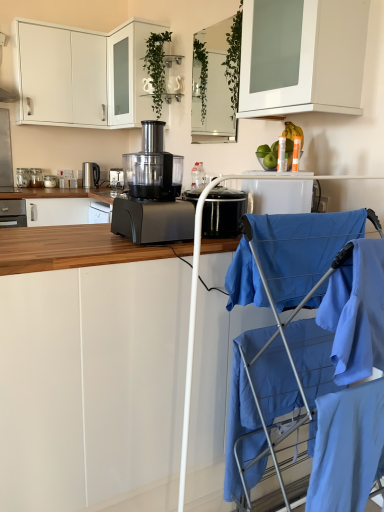
Question: Can you confirm if black plastic food processor at center, the first kitchen appliance from the front, is taller than white glossy cabinet at upper center, the 4th cabinetry positioned from the bottom?

Choices:
 (A) yes
 (B) no

Answer: (B)

Question: Does black plastic food processor at center, placed as the 2th kitchen appliance when sorted from right to left, have a lesser height compared to white glossy cabinet at upper center, marked as the second cabinetry in a top-to-bottom arrangement?

Choices:
 (A) no
 (B) yes

Answer: (B)

Question: Is black plastic food processor at center, placed as the 2th kitchen appliance when sorted from right to left, completely or partially outside of white glossy cabinet at upper center, the 4th cabinetry positioned from the bottom?

Choices:
 (A) yes
 (B) no

Answer: (A)

Question: From the image's perspective, is black plastic food processor at center, positioned as the 5th kitchen appliance in back-to-front order, below white glossy cabinet at upper center, marked as the second cabinetry in a top-to-bottom arrangement?

Choices:
 (A) no
 (B) yes

Answer: (B)

Question: Does black plastic food processor at center, positioned as the 5th kitchen appliance in back-to-front order, have a lesser width compared to white glossy cabinet at upper center, the 4th cabinetry positioned from the bottom?

Choices:
 (A) no
 (B) yes

Answer: (A)

Question: Does point (137, 178) appear closer or farther from the camera than point (220, 88)?

Choices:
 (A) farther
 (B) closer

Answer: (B)

Question: From a real-world perspective, is black plastic food processor at center, the fourth kitchen appliance viewed from the left, positioned above or below clear glass mirror at upper center, the third cabinetry from the bottom?

Choices:
 (A) below
 (B) above

Answer: (A)

Question: Considering the positions of black plastic food processor at center, placed as the 2th kitchen appliance when sorted from right to left, and clear glass mirror at upper center, the third cabinetry from the bottom, in the image, is black plastic food processor at center, placed as the 2th kitchen appliance when sorted from right to left, taller or shorter than clear glass mirror at upper center, the third cabinetry from the bottom,?

Choices:
 (A) tall
 (B) short

Answer: (B)

Question: Visually, is black plastic food processor at center, the fourth kitchen appliance viewed from the left, positioned to the left or to the right of clear glass mirror at upper center, which ranks as the third cabinetry in top-to-bottom order?

Choices:
 (A) left
 (B) right

Answer: (A)

Question: Based on their positions, is white matte cabinet at upper center, the 2th cabinetry from the bottom, located to the left or right of green leafy plant at upper center?

Choices:
 (A) left
 (B) right

Answer: (B)

Question: Considering the positions of white matte cabinet at upper center, the 2th cabinetry from the bottom, and green leafy plant at upper center in the image, is white matte cabinet at upper center, the 2th cabinetry from the bottom, wider or thinner than green leafy plant at upper center?

Choices:
 (A) wide
 (B) thin

Answer: (A)

Question: From a real-world perspective, is white matte cabinet at upper center, which is the 4th cabinetry from top to bottom, above or below green leafy plant at upper center?

Choices:
 (A) below
 (B) above

Answer: (A)

Question: Is white matte cabinet at upper center, which is the 4th cabinetry from top to bottom, inside or outside of green leafy plant at upper center?

Choices:
 (A) inside
 (B) outside

Answer: (B)

Question: Looking at their shapes, would you say clear glass mirror at upper center, which ranks as the third cabinetry in top-to-bottom order, is wider or thinner than white matte cabinet at center, which appears as the fifth cabinetry when viewed from the top?

Choices:
 (A) thin
 (B) wide

Answer: (A)

Question: Considering their positions, is clear glass mirror at upper center, which ranks as the third cabinetry in top-to-bottom order, located in front of or behind white matte cabinet at center, which appears as the fifth cabinetry when viewed from the top?

Choices:
 (A) behind
 (B) front

Answer: (A)